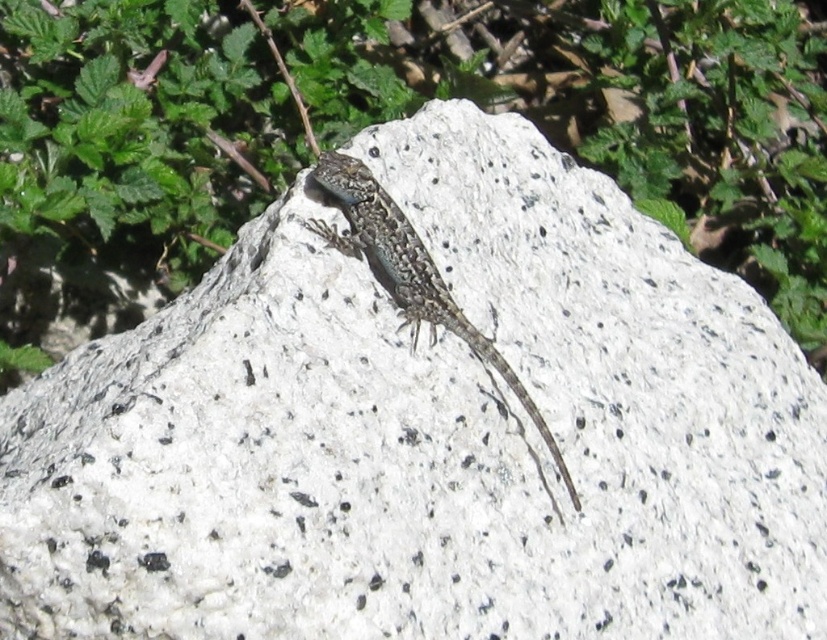
Question: Is green leafy plant at upper center to the left of speckled stone lizard at center from the viewer's perspective?

Choices:
 (A) no
 (B) yes

Answer: (A)

Question: Does green leafy plant at upper center have a lesser width compared to speckled stone lizard at center?

Choices:
 (A) no
 (B) yes

Answer: (A)

Question: Can you confirm if green leafy plant at upper center is positioned below speckled stone lizard at center?

Choices:
 (A) yes
 (B) no

Answer: (B)